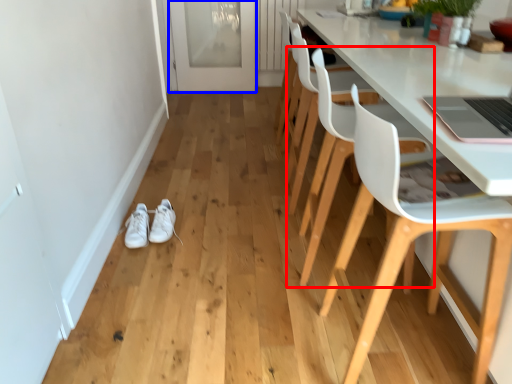
Question: Which point is closer to the camera, chair (highlighted by a red box) or glass door (highlighted by a blue box)?

Choices:
 (A) chair
 (B) glass door

Answer: (A)